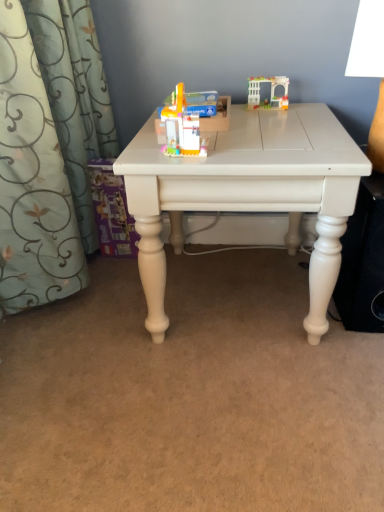
Where is `free space in front of translucent plastic archway at upper right, marked as the 1th toy in a right-to-left arrangement`? The width and height of the screenshot is (384, 512). free space in front of translucent plastic archway at upper right, marked as the 1th toy in a right-to-left arrangement is located at coordinates (278, 115).